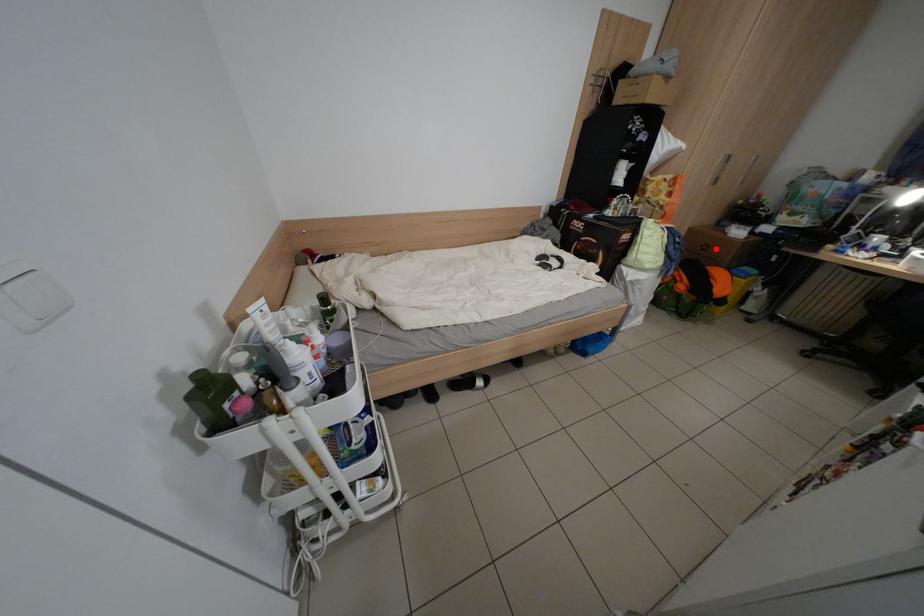
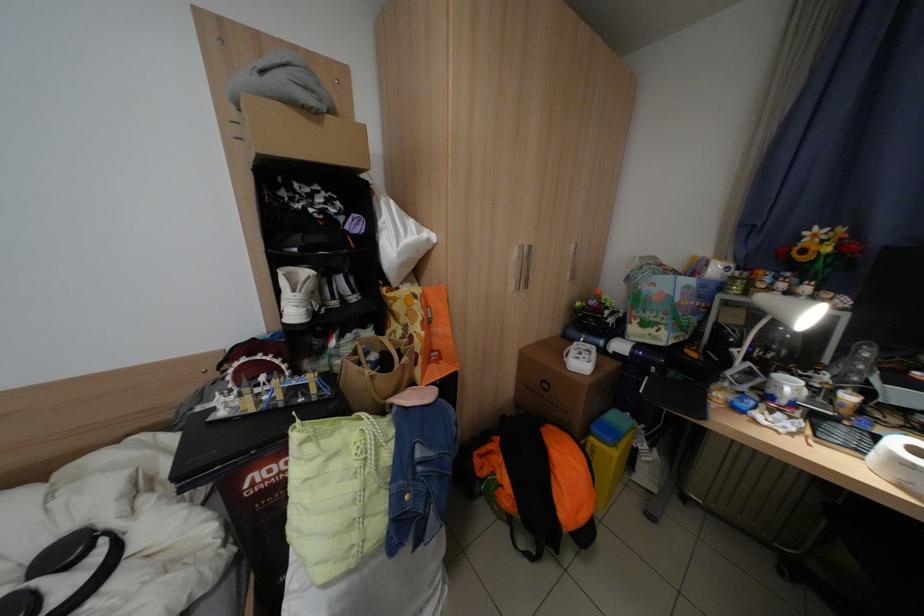
Locate, in the second image, the point that corresponds to the highlighted location in the first image.

(555, 387)